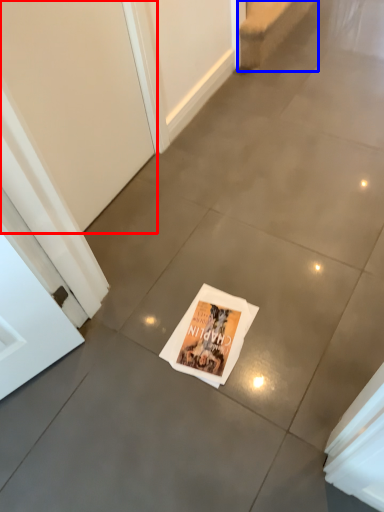
Question: Which object appears closest to the camera in this image, screen door (highlighted by a red box) or stairwell (highlighted by a blue box)?

Choices:
 (A) screen door
 (B) stairwell

Answer: (A)